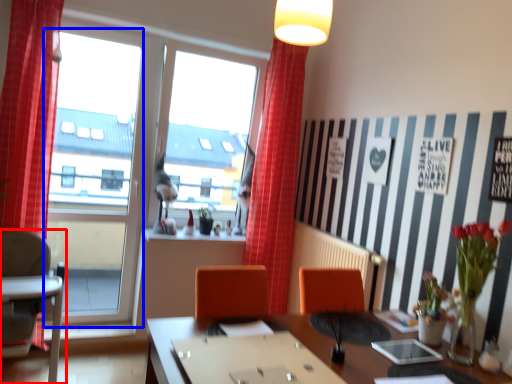
Question: Which object is closer to the camera taking this photo, chair (highlighted by a red box) or window frame (highlighted by a blue box)?

Choices:
 (A) chair
 (B) window frame

Answer: (A)